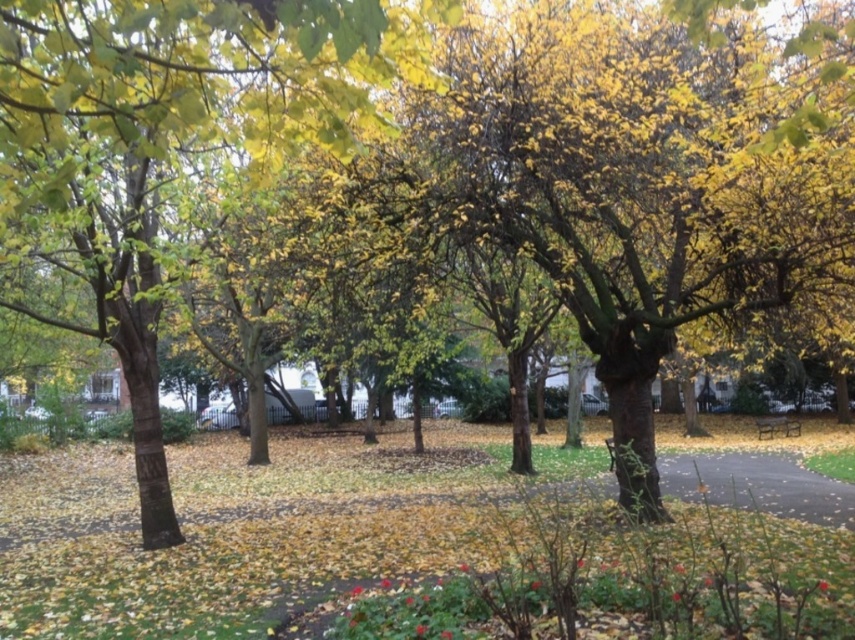
Is point (118, 154) positioned after point (783, 433)?

No.

Identify the location of yellow-green leaves at center. (164, 145).